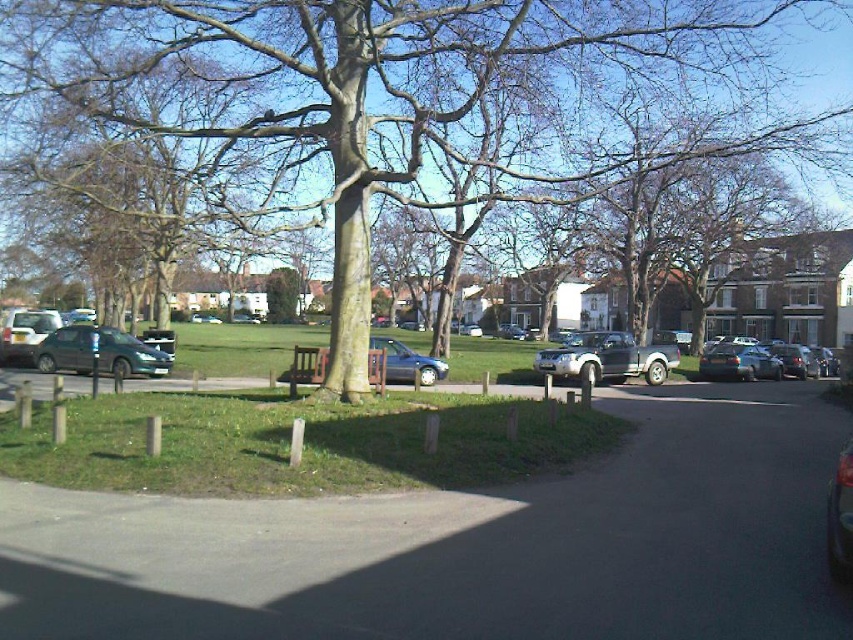
Consider the image. Can you confirm if metallic silver car at left is positioned to the right of metallic silver car at center?

Correct, you'll find metallic silver car at left to the right of metallic silver car at center.

Who is more distant from viewer, [107,328] or [218,317]?

The point [218,317] is behind.

Does point (73, 371) come behind point (190, 321)?

No, it is in front of (190, 321).

The image size is (853, 640). Identify the location of metallic silver car at left. (99, 353).

Which is above, brown textured tree at center or silver metallic pickup truck at center?

brown textured tree at center is above.

I want to click on brown textured tree at center, so click(405, 100).

Can you confirm if brown textured tree at center is wider than metallic silver car at center?

Yes, brown textured tree at center is wider than metallic silver car at center.

Can you confirm if brown textured tree at center is positioned below metallic silver car at center?

Incorrect, brown textured tree at center is not positioned below metallic silver car at center.

Identify the location of brown textured tree at center. (405, 100).